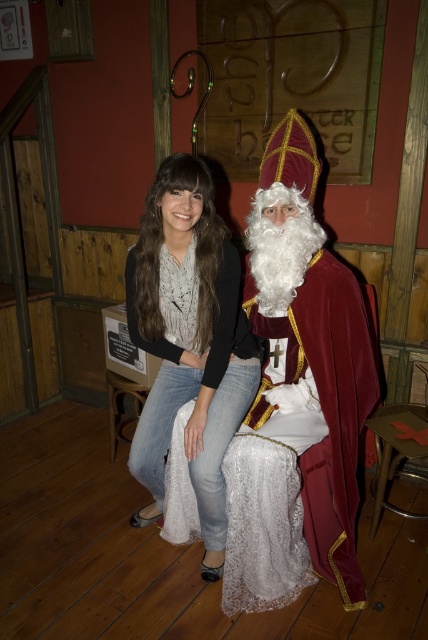
You are a photographer at the event and want to place a spotlight exactly at the center of the velvet maroon cape at center. According to the coordinates provided, where should you aim the spotlight?

The velvet maroon cape at center is located at coordinates point [297,396], so you should aim the spotlight at that exact point.

You are a photographer at this event and want to capture a clear shot of the denim jeans at center without the velvet maroon cape at center covering it. Is this possible given their current positions?

The velvet maroon cape at center is positioned over denim jeans at center, so it is not possible to capture a clear shot of the denim jeans at center without the velvet maroon cape at center covering it.

You are a photographer setting up for a holiday photo shoot. You need to ensure that the velvet maroon cape at center and the denim jeans at center are both visible in the frame. Based on their positions, which object should you adjust to avoid blocking the other?

The velvet maroon cape at center is positioned on the right side of denim jeans at center. To ensure both are visible, you should adjust the velvet maroon cape at center to move it away from the denim jeans at center so they don not overlap.